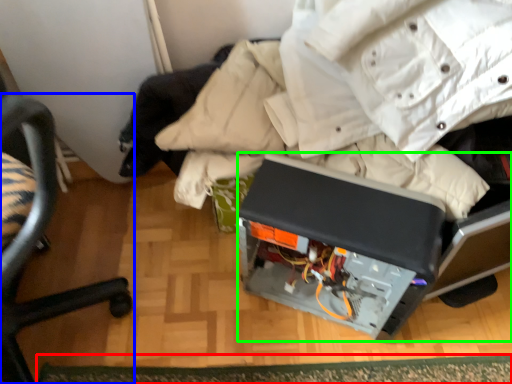
Question: Which is farther away from mat (highlighted by a red box)? chair (highlighted by a blue box) or wide (highlighted by a green box)?

Choices:
 (A) chair
 (B) wide

Answer: (A)